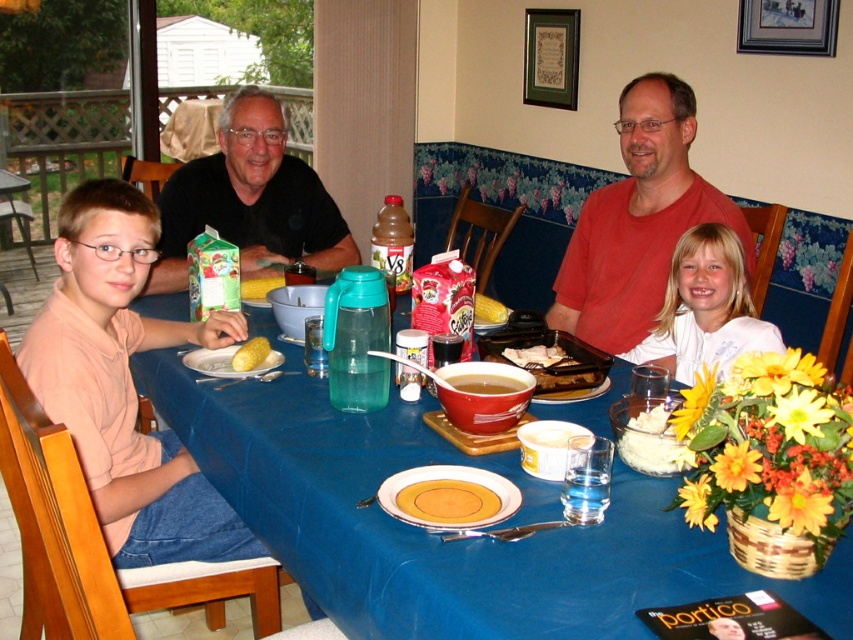
You are a guest at the family gathering and want to reach for the brown matte bowl at center without disturbing the white matte shirt at upper right. Can you safely extend your arm to grab the bowl?

The white matte shirt at upper right is 67.27 centimeters away from the brown matte bowl at center. Since this distance is greater than the typical arm length of an average person, you can safely extend your arm to grab the brown matte bowl at center without disturbing the white matte shirt at upper right.